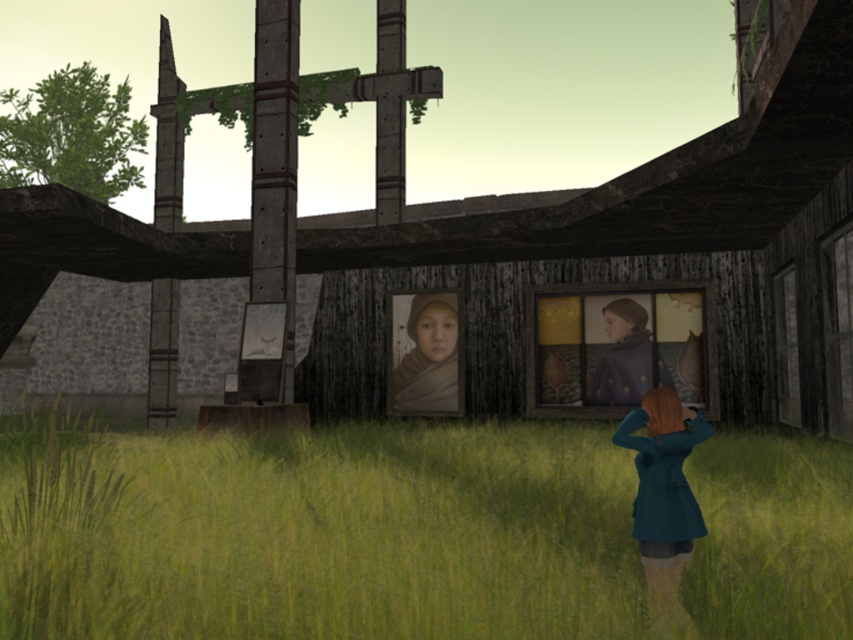
Question: Which point appears farthest from the camera in this image?

Choices:
 (A) (625, 397)
 (B) (668, 454)
 (C) (469, 620)

Answer: (A)

Question: Where is teal fabric coat at lower right located in relation to matte brown scarf at center in the image?

Choices:
 (A) above
 (B) below

Answer: (B)

Question: Which point is closer to the camera?

Choices:
 (A) (695, 506)
 (B) (621, 371)
 (C) (669, 323)
 (D) (108, 573)

Answer: (D)

Question: Does green grass at lower left come behind smooth blue scarf at center?

Choices:
 (A) yes
 (B) no

Answer: (B)

Question: Among these points, which one is farthest from the camera?

Choices:
 (A) (701, 323)
 (B) (668, 388)
 (C) (639, 355)
 (D) (410, 332)

Answer: (D)

Question: Is green grass at lower left further to the viewer compared to smooth blue scarf at center?

Choices:
 (A) no
 (B) yes

Answer: (A)